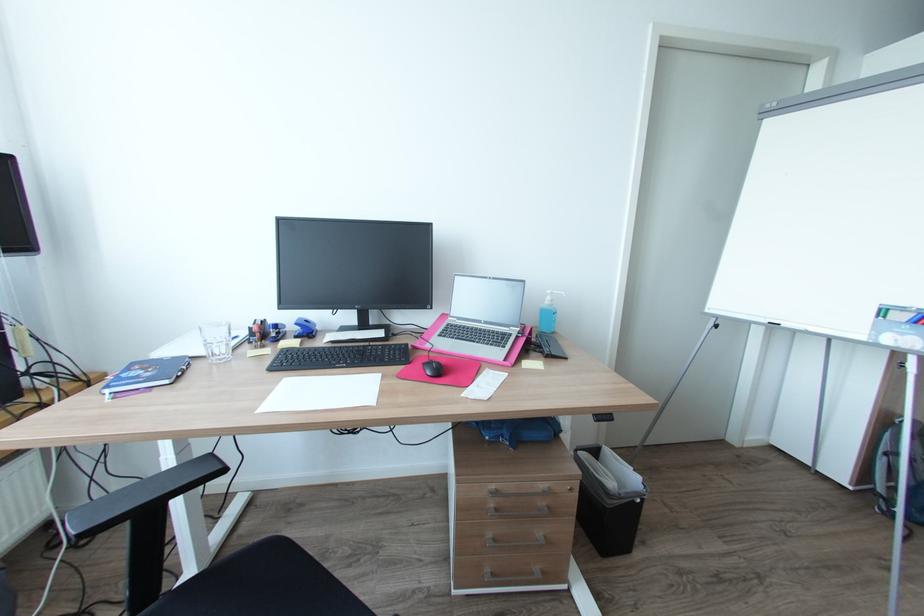
Where would you push the sanitizer bottle pump? Please return your answer as a coordinate pair (x, y).

(546, 320)